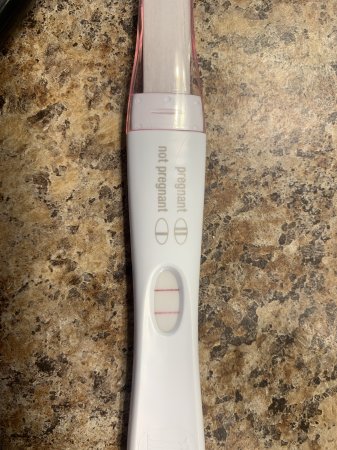
Find the location of a particular element. The height and width of the screenshot is (450, 337). reflection light is located at coordinates (293, 126).